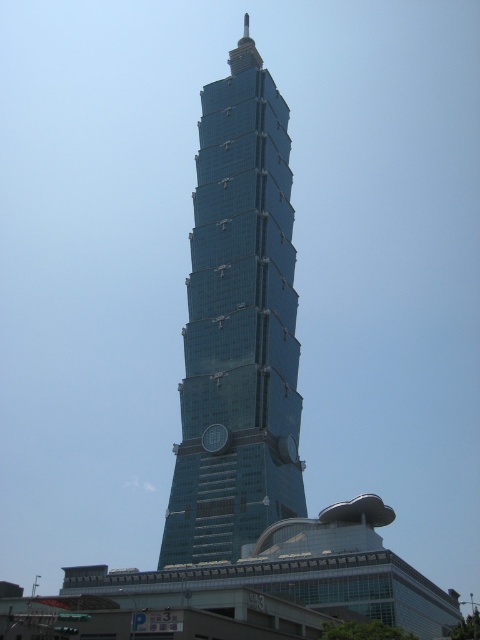
Question: Where is glassy blue skyscraper at center located in relation to metallic silver clock at center in the image?

Choices:
 (A) left
 (B) right

Answer: (A)

Question: Which object is the closest to the metallic silver clock at center?

Choices:
 (A) glassy blue skyscraper at center
 (B) metallic clock at center

Answer: (B)

Question: Which point is closer to the camera?

Choices:
 (A) metallic clock at center
 (B) glassy blue skyscraper at center
 (C) metallic silver clock at center

Answer: (B)

Question: Can you confirm if glassy blue skyscraper at center is wider than metallic silver clock at center?

Choices:
 (A) yes
 (B) no

Answer: (A)

Question: Among these points, which one is nearest to the camera?

Choices:
 (A) click(214, 428)
 (B) click(259, 365)

Answer: (A)

Question: Is glassy blue skyscraper at center positioned before metallic clock at center?

Choices:
 (A) no
 (B) yes

Answer: (B)